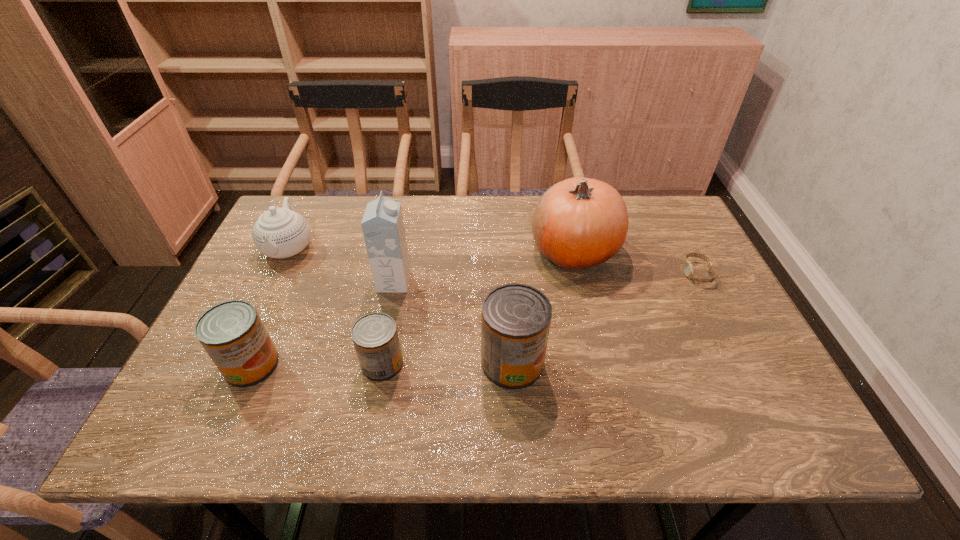
Identify the location of the second shortest can. (232, 333).

Where is `the second can from left to right`? The height and width of the screenshot is (540, 960). the second can from left to right is located at coordinates (375, 337).

The width and height of the screenshot is (960, 540). I want to click on the second shortest object, so click(375, 337).

Find the location of a particular element. Image resolution: width=960 pixels, height=540 pixels. the fifth object from left to right is located at coordinates (515, 318).

At what (x,y) coordinates should I click in order to perform the action: click on the tallest can. Please return your answer as a coordinate pair (x, y). Looking at the image, I should click on (515, 318).

Identify the location of carton. (382, 224).

Identify the location of the second object from right to left. (578, 223).

Where is `chinaware`? chinaware is located at coordinates (279, 233).

At what (x,y) coordinates should I click in order to perform the action: click on watch. Please return your answer as a coordinate pair (x, y). Image resolution: width=960 pixels, height=540 pixels. Looking at the image, I should click on (688, 266).

Where is `the rightmost object`? This screenshot has height=540, width=960. the rightmost object is located at coordinates (688, 266).